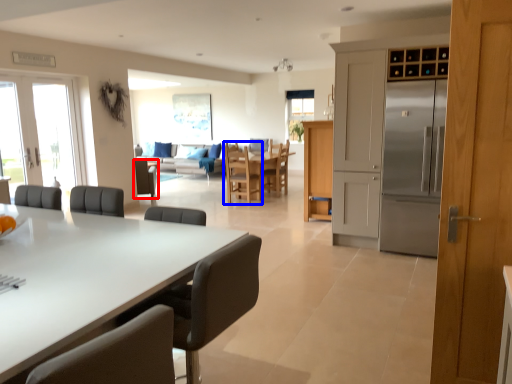
Question: Which object is further to the camera taking this photo, chair (highlighted by a red box) or chair (highlighted by a blue box)?

Choices:
 (A) chair
 (B) chair

Answer: (A)